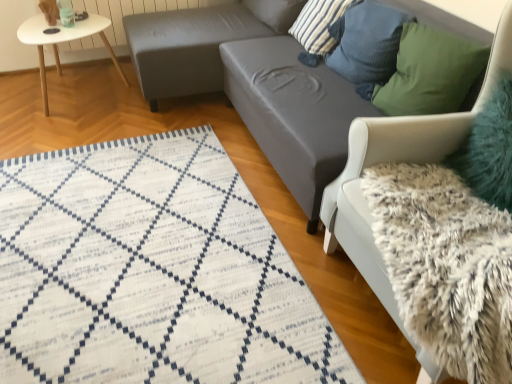
Question: In terms of size, does teal fuzzy pillow at upper right, the fifth pillow when ordered from back to front, appear bigger or smaller than white glossy table at upper left?

Choices:
 (A) big
 (B) small

Answer: (B)

Question: From a real-world perspective, is teal fuzzy pillow at upper right, marked as the first pillow in a front-to-back arrangement, positioned above or below white glossy table at upper left?

Choices:
 (A) below
 (B) above

Answer: (B)

Question: Based on their relative distances, which object is nearer to the green fabric pillow at upper right, which is the 4th pillow in back-to-front order?

Choices:
 (A) white woven mat at lower left
 (B) teal fuzzy pillow at upper right, marked as the first pillow in a front-to-back arrangement
 (C) white fluffy swivel chair at right
 (D) blue textured pillow at upper right, which is counted as the third pillow, starting from the front
 (E) striped fabric pillow at upper right, the 2th pillow when ordered from back to front

Answer: (D)

Question: Which object is the farthest from the white woven mat at lower left?

Choices:
 (A) white glossy table at upper left
 (B) white fluffy swivel chair at right
 (C) gray fabric footrest at center
 (D) gray fabric couch at center
 (E) blue textured pillow at upper right, which is counted as the third pillow, starting from the front

Answer: (A)